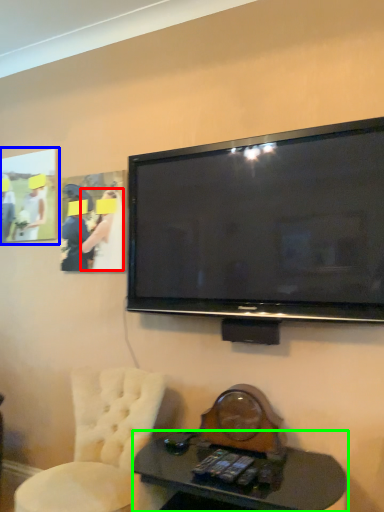
Question: Which is nearer to the person (highlighted by a red box)? picture frame (highlighted by a blue box) or desk (highlighted by a green box).

Choices:
 (A) picture frame
 (B) desk

Answer: (A)